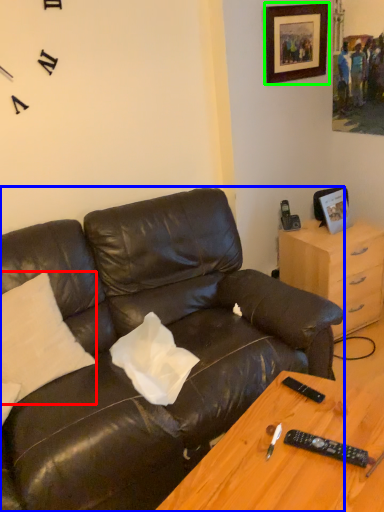
Question: Which is farther away from pillow (highlighted by a red box)? studio couch (highlighted by a blue box) or picture frame (highlighted by a green box)?

Choices:
 (A) studio couch
 (B) picture frame

Answer: (B)